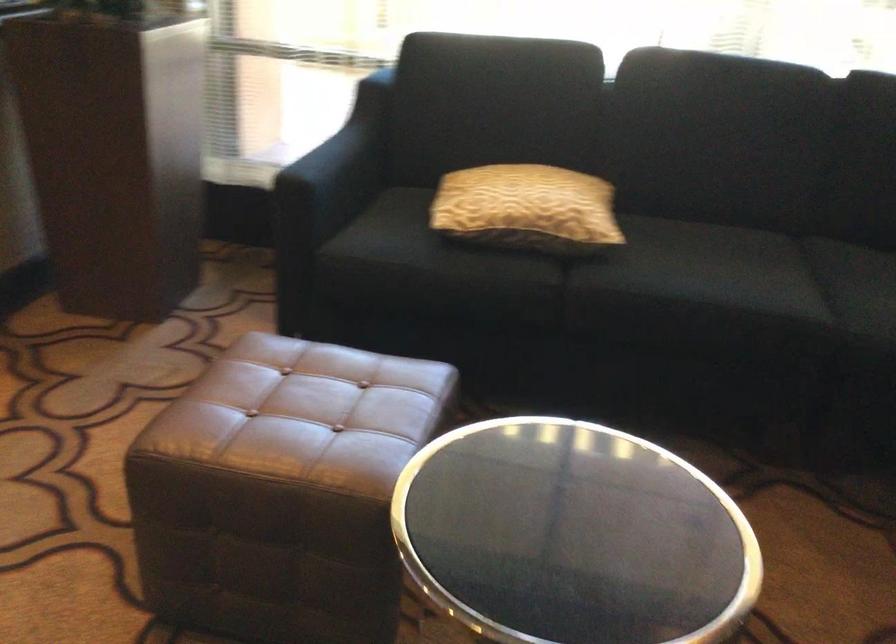
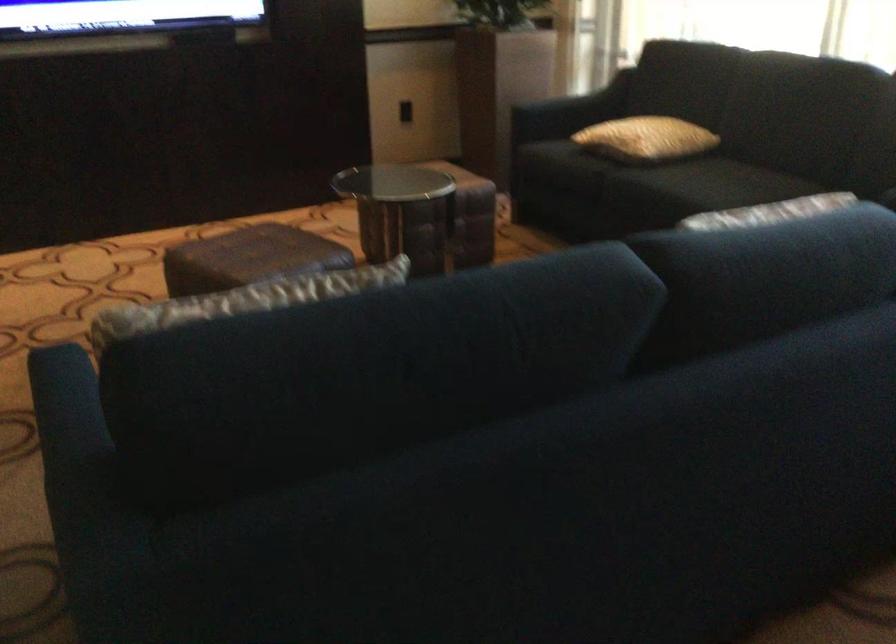
In the second image, find the point that corresponds to [587,218] in the first image.

(645, 138)